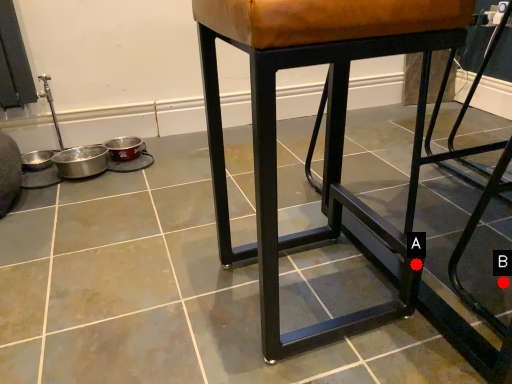
Question: Two points are circled on the image, labeled by A and B beside each circle. Among these points, which one is farthest from the camera?

Choices:
 (A) A is further
 (B) B is further

Answer: (B)